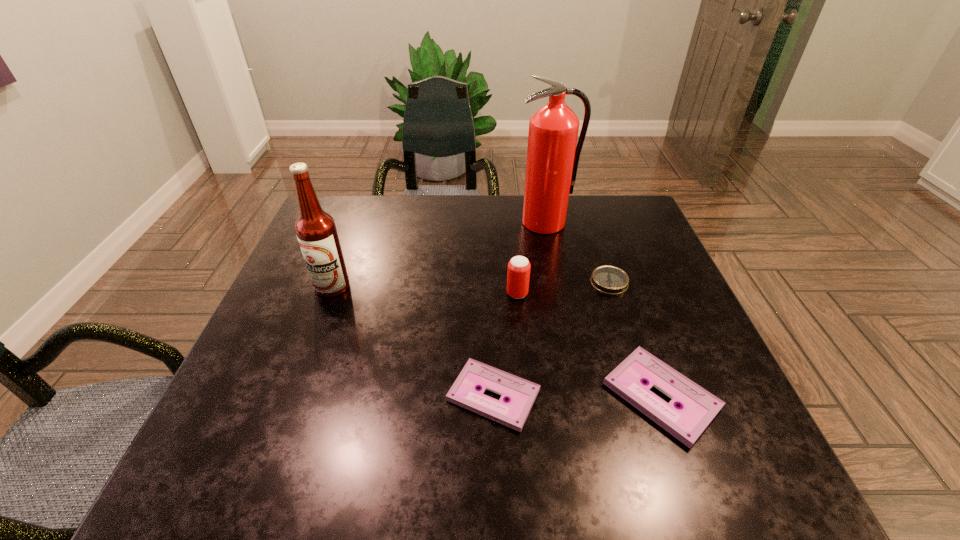
Where is `free space between the fire extinguisher and the fifth shortest object`? free space between the fire extinguisher and the fifth shortest object is located at coordinates (439, 255).

The height and width of the screenshot is (540, 960). Identify the location of free spot between the second tallest object and the compass. (470, 285).

Locate an element on the screen. free point between the right videotape and the fourth shortest object is located at coordinates (589, 345).

This screenshot has height=540, width=960. Find the location of `free spot between the tallest object and the taller videotape`. free spot between the tallest object and the taller videotape is located at coordinates (603, 309).

At what (x,y) coordinates should I click in order to perform the action: click on free space between the beer can and the left videotape. Please return your answer as a coordinate pair (x, y). The height and width of the screenshot is (540, 960). Looking at the image, I should click on (505, 345).

Find the location of `vacant area between the third tallest object and the left videotape`. vacant area between the third tallest object and the left videotape is located at coordinates (505, 345).

At what (x,y) coordinates should I click in order to perform the action: click on the second closest object to the right videotape. Please return your answer as a coordinate pair (x, y). This screenshot has width=960, height=540. Looking at the image, I should click on (612, 280).

I want to click on object that stands as the fourth closest to the third tallest object, so click(x=552, y=155).

Where is `blank area in the image that satisfies the following two spatial constraints: 1. on the label side of the second tallest object; 2. on the right side of the beer can`? The image size is (960, 540). blank area in the image that satisfies the following two spatial constraints: 1. on the label side of the second tallest object; 2. on the right side of the beer can is located at coordinates (329, 294).

Where is `vacant area that satisfies the following two spatial constraints: 1. on the front side of the taller videotape; 2. on the right side of the fourth shortest object`? vacant area that satisfies the following two spatial constraints: 1. on the front side of the taller videotape; 2. on the right side of the fourth shortest object is located at coordinates (527, 396).